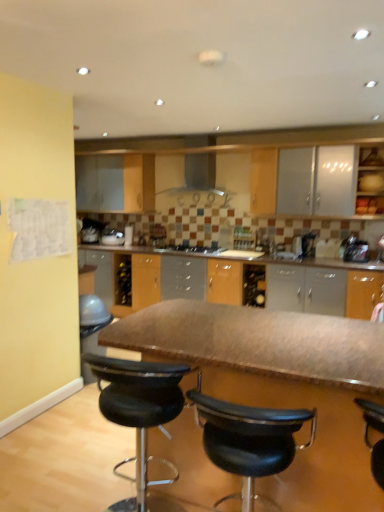
The width and height of the screenshot is (384, 512). Describe the element at coordinates (354, 249) in the screenshot. I see `satin black kettle at right, acting as the 1th appliance starting from the front` at that location.

Locate an element on the screen. satin black kettle at right, placed as the first appliance when sorted from right to left is located at coordinates (354, 249).

What is the approximate width of smooth brown table at center?

smooth brown table at center is 37.81 inches in width.

Locate an element on the screen. This screenshot has height=512, width=384. smooth brown table at center is located at coordinates point(279,384).

The height and width of the screenshot is (512, 384). Describe the element at coordinates (370, 183) in the screenshot. I see `matte wood cabinet at upper right` at that location.

Where is `satin silver toaster at center, the 1th appliance when ordered from left to right`? satin silver toaster at center, the 1th appliance when ordered from left to right is located at coordinates (112, 237).

What do you see at coordinates (249, 440) in the screenshot? I see `black leather stool at center, which appears as the first chair when viewed from the right` at bounding box center [249, 440].

At what (x,y) coordinates should I click in order to perform the action: click on black leather stool at center, the 2th chair in the left-to-right sequence. Please return your answer as a coordinate pair (x, y). This screenshot has width=384, height=512. Looking at the image, I should click on (249, 440).

This screenshot has height=512, width=384. I want to click on black leather stool at center, positioned as the second chair in right-to-left order, so click(x=139, y=414).

Is satin silver toaster at center, marked as the second appliance in a front-to-back arrangement, far away from matte wood cabinet at upper right?

Indeed, satin silver toaster at center, marked as the second appliance in a front-to-back arrangement, is not near matte wood cabinet at upper right.

Is satin silver toaster at center, the 1th appliance when ordered from left to right, taller than matte wood cabinet at upper right?

In fact, satin silver toaster at center, the 1th appliance when ordered from left to right, may be shorter than matte wood cabinet at upper right.

Which is more to the right, satin silver toaster at center, the 1th appliance when ordered from left to right, or matte wood cabinet at upper right?

matte wood cabinet at upper right is more to the right.

How distant is satin silver toaster at center, which appears as the 1th appliance when viewed from the back, from matte wood cabinet at upper right?

satin silver toaster at center, which appears as the 1th appliance when viewed from the back, and matte wood cabinet at upper right are 2.90 meters apart from each other.

Is black leather stool at center, positioned as the second chair in right-to-left order, inside or outside of black leather stool at center, which appears as the first chair when viewed from the right?

black leather stool at center, positioned as the second chair in right-to-left order, is spatially situated outside black leather stool at center, which appears as the first chair when viewed from the right.

Does black leather stool at center, positioned as the second chair in right-to-left order, have a greater width compared to black leather stool at center, which appears as the first chair when viewed from the right?

Incorrect, the width of black leather stool at center, positioned as the second chair in right-to-left order, does not surpass that of black leather stool at center, which appears as the first chair when viewed from the right.

Would you consider black leather stool at center, which is the first chair in left-to-right order, to be distant from black leather stool at center, which appears as the first chair when viewed from the right?

That's not correct — black leather stool at center, which is the first chair in left-to-right order, is a little close to black leather stool at center, which appears as the first chair when viewed from the right.

From a real-world perspective, who is located higher, black leather stool at center, positioned as the second chair in right-to-left order, or black leather stool at center, the 2th chair in the left-to-right sequence?

black leather stool at center, positioned as the second chair in right-to-left order.

Which object is further away from the camera, satin black kettle at right, which is the second appliance from back to front, or black leather stool at center, the 2th chair in the left-to-right sequence?

satin black kettle at right, which is the second appliance from back to front, is further from the camera.

Could you measure the distance between satin black kettle at right, placed as the first appliance when sorted from right to left, and black leather stool at center, the 2th chair in the left-to-right sequence?

They are 10.40 feet apart.

Which of these two, satin black kettle at right, which is the second appliance from back to front, or black leather stool at center, which appears as the first chair when viewed from the right, is smaller?

With smaller size is satin black kettle at right, which is the second appliance from back to front.

Is point (356, 253) farther from camera compared to point (217, 419)?

That is True.

Is black leather stool at center, the 2th chair in the left-to-right sequence, touching satin silver toaster at center, which appears as the 1th appliance when viewed from the back?

black leather stool at center, the 2th chair in the left-to-right sequence, and satin silver toaster at center, which appears as the 1th appliance when viewed from the back, are not in contact.

Is black leather stool at center, which appears as the first chair when viewed from the right, smaller than satin silver toaster at center, the 1th appliance when ordered from left to right?

Incorrect, black leather stool at center, which appears as the first chair when viewed from the right, is not smaller in size than satin silver toaster at center, the 1th appliance when ordered from left to right.

Based on the photo, who is taller, black leather stool at center, which appears as the first chair when viewed from the right, or satin silver toaster at center, the second appliance viewed from the right?

Standing taller between the two is black leather stool at center, which appears as the first chair when viewed from the right.

From the image's perspective, would you say satin black kettle at right, the second appliance in the left-to-right sequence, is shown under black leather stool at center, positioned as the second chair in right-to-left order?

No.

Is there a large distance between satin black kettle at right, placed as the first appliance when sorted from right to left, and black leather stool at center, positioned as the second chair in right-to-left order?

Yes, satin black kettle at right, placed as the first appliance when sorted from right to left, is far from black leather stool at center, positioned as the second chair in right-to-left order.

Looking at this image, from a real-world perspective, is satin black kettle at right, placed as the first appliance when sorted from right to left, beneath black leather stool at center, which is the first chair in left-to-right order?

No, from a real-world perspective, satin black kettle at right, placed as the first appliance when sorted from right to left, is not below black leather stool at center, which is the first chair in left-to-right order.

In the scene shown: Looking at their sizes, would you say satin silver toaster at center, the 1th appliance when ordered from left to right, is wider or thinner than black leather stool at center, which appears as the first chair when viewed from the right?

In the image, satin silver toaster at center, the 1th appliance when ordered from left to right, appears to be more narrow than black leather stool at center, which appears as the first chair when viewed from the right.

From the image's perspective, is satin silver toaster at center, marked as the second appliance in a front-to-back arrangement, located above or below black leather stool at center, which appears as the first chair when viewed from the right?

satin silver toaster at center, marked as the second appliance in a front-to-back arrangement, is situated higher than black leather stool at center, which appears as the first chair when viewed from the right, in the image.

Can you confirm if satin silver toaster at center, which appears as the 1th appliance when viewed from the back, is positioned to the left of black leather stool at center, which appears as the first chair when viewed from the right?

Indeed, satin silver toaster at center, which appears as the 1th appliance when viewed from the back, is positioned on the left side of black leather stool at center, which appears as the first chair when viewed from the right.

From the image's perspective, does smooth brown table at center appear lower than black leather stool at center, which is the first chair in left-to-right order?

No, from the image's perspective, smooth brown table at center is not below black leather stool at center, which is the first chair in left-to-right order.

Would you say black leather stool at center, which is the first chair in left-to-right order, is part of smooth brown table at center's contents?

Absolutely, black leather stool at center, which is the first chair in left-to-right order, is inside smooth brown table at center.

Does smooth brown table at center have a larger size compared to black leather stool at center, which is the first chair in left-to-right order?

Correct, smooth brown table at center is larger in size than black leather stool at center, which is the first chair in left-to-right order.

Between smooth brown table at center and black leather stool at center, which is the first chair in left-to-right order, which one appears on the right side from the viewer's perspective?

smooth brown table at center.

The image size is (384, 512). Identify the location of cabinetry that appears on the right of satin silver toaster at center, which appears as the 1th appliance when viewed from the back. (370, 183).

This screenshot has width=384, height=512. In order to click on chair behind the black leather stool at center, which appears as the first chair when viewed from the right in this screenshot , I will do `click(139, 414)`.

Based on the photo, which object lies further to the anchor point smooth brown table at center, satin black kettle at right, acting as the 1th appliance starting from the front, or black leather stool at center, which is the first chair in left-to-right order?

The object further to smooth brown table at center is satin black kettle at right, acting as the 1th appliance starting from the front.

Based on their spatial positions, is black leather stool at center, the 2th chair in the left-to-right sequence, or satin black kettle at right, which is the second appliance from back to front, closer to satin silver toaster at center, the 1th appliance when ordered from left to right?

satin black kettle at right, which is the second appliance from back to front, is positioned closer to the anchor satin silver toaster at center, the 1th appliance when ordered from left to right.

When comparing their distances from black leather stool at center, positioned as the second chair in right-to-left order, does matte wood cabinet at upper right or black leather stool at center, which appears as the first chair when viewed from the right, seem closer?

black leather stool at center, which appears as the first chair when viewed from the right, lies closer to black leather stool at center, positioned as the second chair in right-to-left order, than the other object.

Considering their positions, is satin silver toaster at center, marked as the second appliance in a front-to-back arrangement, positioned further to satin black kettle at right, placed as the first appliance when sorted from right to left, than smooth brown table at center?

Among the two, satin silver toaster at center, marked as the second appliance in a front-to-back arrangement, is located further to satin black kettle at right, placed as the first appliance when sorted from right to left.

Looking at the image, which one is located closer to black leather stool at center, positioned as the second chair in right-to-left order, black leather stool at center, which appears as the first chair when viewed from the right, or matte wood cabinet at upper right?

Based on the image, black leather stool at center, which appears as the first chair when viewed from the right, appears to be nearer to black leather stool at center, positioned as the second chair in right-to-left order.

Based on their spatial positions, is satin silver toaster at center, marked as the second appliance in a front-to-back arrangement, or matte wood cabinet at upper right closer to black leather stool at center, which is the first chair in left-to-right order?

matte wood cabinet at upper right.

Which object lies further to the anchor point satin silver toaster at center, the 1th appliance when ordered from left to right, black leather stool at center, positioned as the second chair in right-to-left order, or smooth brown table at center?

The object further to satin silver toaster at center, the 1th appliance when ordered from left to right, is smooth brown table at center.

Which object lies nearer to the anchor point black leather stool at center, the 2th chair in the left-to-right sequence, black leather stool at center, positioned as the second chair in right-to-left order, or satin silver toaster at center, marked as the second appliance in a front-to-back arrangement?

Among the two, black leather stool at center, positioned as the second chair in right-to-left order, is located nearer to black leather stool at center, the 2th chair in the left-to-right sequence.

The image size is (384, 512). What are the coordinates of `table between black leather stool at center, which appears as the first chair when viewed from the right, and satin silver toaster at center, marked as the second appliance in a front-to-back arrangement, in the front-back direction` in the screenshot? It's located at (279, 384).

Where is `cabinetry between black leather stool at center, the 2th chair in the left-to-right sequence, and satin black kettle at right, placed as the first appliance when sorted from right to left, along the z-axis`? cabinetry between black leather stool at center, the 2th chair in the left-to-right sequence, and satin black kettle at right, placed as the first appliance when sorted from right to left, along the z-axis is located at coordinates (370, 183).

Identify the location of table positioned between black leather stool at center, which appears as the first chair when viewed from the right, and matte wood cabinet at upper right from near to far. (279, 384).

You are a GUI agent. You are given a task and a screenshot of the screen. Output one action in this format:
    pyautogui.click(x=<x>, y=<y>)
    Task: Click on the chair between black leather stool at center, the 2th chair in the left-to-right sequence, and satin black kettle at right, which is the second appliance from back to front, from front to back
    Image resolution: width=384 pixels, height=512 pixels.
    Given the screenshot: What is the action you would take?
    pyautogui.click(x=139, y=414)